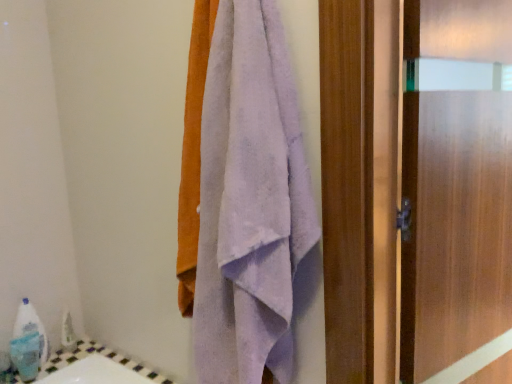
This screenshot has width=512, height=384. What do you see at coordinates (455, 181) in the screenshot? I see `frosted glass door at right` at bounding box center [455, 181].

Find the location of a particular element. frosted glass door at right is located at coordinates (455, 181).

What is the approximate height of frosted glass door at right?

The height of frosted glass door at right is 3.68 feet.

This screenshot has height=384, width=512. I want to click on lavender soft towel at center, so click(x=252, y=205).

What do you see at coordinates (252, 205) in the screenshot? I see `lavender soft towel at center` at bounding box center [252, 205].

Image resolution: width=512 pixels, height=384 pixels. Find the location of `frosted glass door at right`. frosted glass door at right is located at coordinates (455, 181).

Considering the relative positions of lavender soft towel at center and frosted glass door at right in the image provided, is lavender soft towel at center to the left or to the right of frosted glass door at right?

Based on their positions, lavender soft towel at center is located to the left of frosted glass door at right.

Is lavender soft towel at center behind frosted glass door at right?

That is False.

Is point (227, 288) positioned in front of point (480, 159)?

Yes, it is in front of point (480, 159).

From the image's perspective, would you say lavender soft towel at center is shown under frosted glass door at right?

No.

In the scene shown: From a real-world perspective, is lavender soft towel at center on top of frosted glass door at right?

Yes, from a real-world perspective, lavender soft towel at center is over frosted glass door at right

Which object is thinner, lavender soft towel at center or frosted glass door at right?

Thinner between the two is frosted glass door at right.

Who is shorter, lavender soft towel at center or frosted glass door at right?

lavender soft towel at center.

Can you confirm if lavender soft towel at center is bigger than frosted glass door at right?

No, lavender soft towel at center is not bigger than frosted glass door at right.

Is lavender soft towel at center situated inside frosted glass door at right or outside?

lavender soft towel at center is not enclosed by frosted glass door at right.

Would you say lavender soft towel at center is a long distance from frosted glass door at right?

That's not correct — lavender soft towel at center is a little close to frosted glass door at right.

Is lavender soft towel at center facing away from frosted glass door at right?

No.

Where is `towel above the frosted glass door at right (from the image's perspective)`? towel above the frosted glass door at right (from the image's perspective) is located at coordinates (252, 205).

Based on the photo, based on their positions, is frosted glass door at right located to the left or right of lavender soft towel at center?

From the image, it's evident that frosted glass door at right is to the right of lavender soft towel at center.

Which object is further away from the camera taking this photo, frosted glass door at right or lavender soft towel at center?

Positioned behind is frosted glass door at right.

Is point (486, 281) in front of point (255, 378)?

No, (486, 281) is behind (255, 378).

From the image's perspective, does frosted glass door at right appear lower than lavender soft towel at center?

Correct, frosted glass door at right appears lower than lavender soft towel at center in the image.

From a real-world perspective, does frosted glass door at right stand above lavender soft towel at center?

No, from a real-world perspective, frosted glass door at right is not over lavender soft towel at center

Between frosted glass door at right and lavender soft towel at center, which one has larger width?

lavender soft towel at center.

In terms of height, does frosted glass door at right look taller or shorter compared to lavender soft towel at center?

Considering their sizes, frosted glass door at right has more height than lavender soft towel at center.

Can you confirm if frosted glass door at right is bigger than lavender soft towel at center?

Yes.

Can we say frosted glass door at right lies outside lavender soft towel at center?

Indeed, frosted glass door at right is completely outside lavender soft towel at center.

Is there a large distance between frosted glass door at right and lavender soft towel at center?

That's not correct — frosted glass door at right is a little close to lavender soft towel at center.

Could you tell me if frosted glass door at right is facing lavender soft towel at center?

No, frosted glass door at right does not turn towards lavender soft towel at center.

How many degrees apart are the facing directions of frosted glass door at right and lavender soft towel at center?

69.1 degrees separate the facing orientations of frosted glass door at right and lavender soft towel at center.

Where is `towel above the frosted glass door at right (from the image's perspective)`? This screenshot has width=512, height=384. towel above the frosted glass door at right (from the image's perspective) is located at coordinates (252, 205).

Where is `towel in front of the frosted glass door at right`? This screenshot has width=512, height=384. towel in front of the frosted glass door at right is located at coordinates tap(252, 205).

Find the location of a particular element. This screenshot has height=384, width=512. screen door lying behind the lavender soft towel at center is located at coordinates (455, 181).